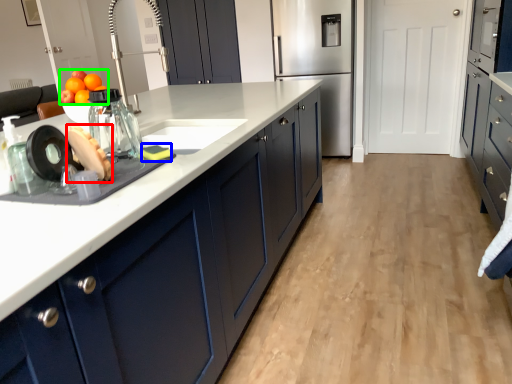
Question: Based on their relative distances, which object is farther from food (highlighted by a red box)? Choose from food (highlighted by a blue box) and fruit (highlighted by a green box).

Choices:
 (A) food
 (B) fruit

Answer: (B)